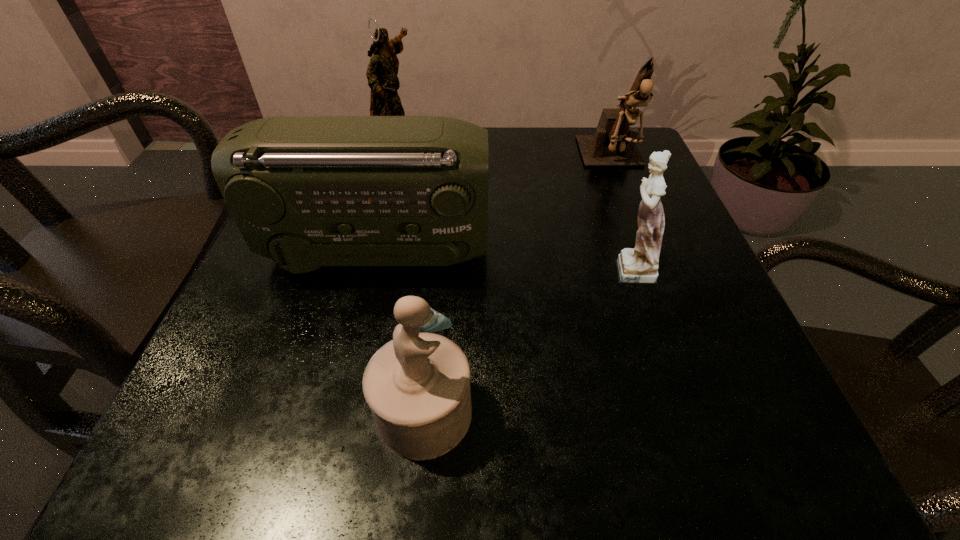
Locate an element on the screen. This screenshot has height=540, width=960. radio_receiver is located at coordinates click(304, 191).

Image resolution: width=960 pixels, height=540 pixels. What are the coordinates of `the second nearest figurine` in the screenshot? It's located at (638, 265).

I want to click on the nearest object, so click(417, 385).

Locate an element on the screen. The width and height of the screenshot is (960, 540). free space located on the front-facing side of the radio_receiver is located at coordinates (569, 253).

Where is `vacant space located on the front-facing side of the third farthest figurine`? vacant space located on the front-facing side of the third farthest figurine is located at coordinates (377, 267).

Locate an element on the screen. Image resolution: width=960 pixels, height=540 pixels. blank area located on the front-facing side of the third farthest figurine is located at coordinates (560, 267).

Locate an element on the screen. vacant space located 0.340m on the front-facing side of the third farthest figurine is located at coordinates (396, 267).

This screenshot has width=960, height=540. What are the coordinates of `free spot located at the beak of the nearest figurine` in the screenshot? It's located at (552, 412).

I want to click on object positioned at the near edge, so (x=417, y=385).

Identify the location of figurine that is positioned at the left edge. The width and height of the screenshot is (960, 540). (382, 71).